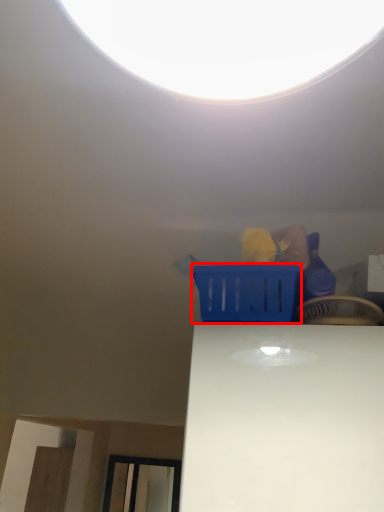
Question: From the image's perspective, where is basket (annotated by the red box) located in relation to basket in the image?

Choices:
 (A) above
 (B) below

Answer: (B)